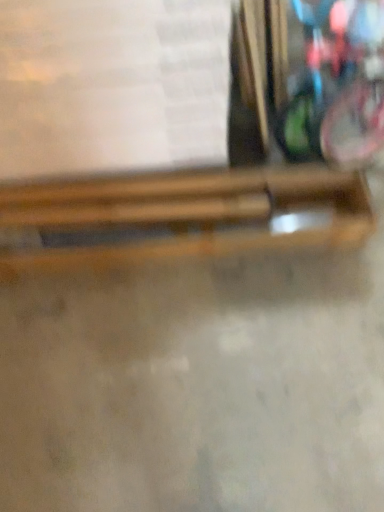
Question: Is white paper at upper center with wooden chopsticks at center, the second wood in the bottom-to-top sequence?

Choices:
 (A) no
 (B) yes

Answer: (A)

Question: Does white paper at upper center have a lesser width compared to wooden chopsticks at center, the second wood in the bottom-to-top sequence?

Choices:
 (A) yes
 (B) no

Answer: (B)

Question: Is the position of white paper at upper center less distant than that of wooden chopsticks at center, the second wood in the bottom-to-top sequence?

Choices:
 (A) no
 (B) yes

Answer: (B)

Question: Is white paper at upper center oriented away from wooden chopsticks at center, which is the first wood in top-to-bottom order?

Choices:
 (A) yes
 (B) no

Answer: (B)

Question: Can you confirm if white paper at upper center is smaller than wooden chopsticks at center, which is the first wood in top-to-bottom order?

Choices:
 (A) no
 (B) yes

Answer: (A)

Question: Is wooden chopsticks at center, which is the 1th wood from bottom to top, in front of or behind white paper at upper center in the image?

Choices:
 (A) behind
 (B) front

Answer: (A)

Question: From the image's perspective, is wooden chopsticks at center, which is counted as the second wood, starting from the top, located above or below white paper at upper center?

Choices:
 (A) above
 (B) below

Answer: (B)

Question: Is wooden chopsticks at center, which is counted as the second wood, starting from the top, inside the boundaries of white paper at upper center, or outside?

Choices:
 (A) outside
 (B) inside

Answer: (A)

Question: From their relative heights in the image, would you say wooden chopsticks at center, which is the 1th wood from bottom to top, is taller or shorter than white paper at upper center?

Choices:
 (A) tall
 (B) short

Answer: (B)

Question: From the image's perspective, is wooden chopsticks at center, the second wood in the bottom-to-top sequence, above or below white paper at upper center?

Choices:
 (A) below
 (B) above

Answer: (A)

Question: Relative to white paper at upper center, is wooden chopsticks at center, the second wood in the bottom-to-top sequence, in front or behind?

Choices:
 (A) behind
 (B) front

Answer: (A)

Question: Considering the positions of wooden chopsticks at center, the second wood in the bottom-to-top sequence, and white paper at upper center in the image, is wooden chopsticks at center, the second wood in the bottom-to-top sequence, taller or shorter than white paper at upper center?

Choices:
 (A) short
 (B) tall

Answer: (A)

Question: In the image, is wooden chopsticks at center, which is the first wood in top-to-bottom order, on the left side or the right side of white paper at upper center?

Choices:
 (A) right
 (B) left

Answer: (A)

Question: Does point (134, 177) appear closer or farther from the camera than point (223, 202)?

Choices:
 (A) closer
 (B) farther

Answer: (B)

Question: In terms of size, does wooden chopsticks at center, which is the 1th wood from bottom to top, appear bigger or smaller than wooden chopsticks at center, which is the first wood in top-to-bottom order?

Choices:
 (A) big
 (B) small

Answer: (A)